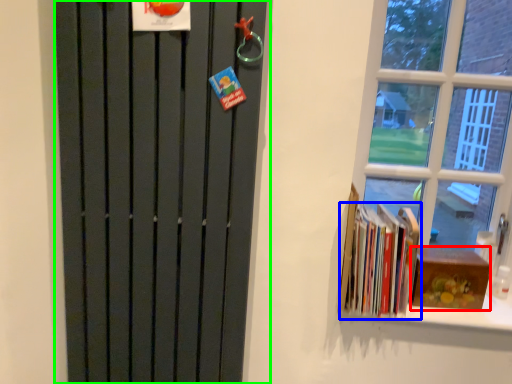
Question: Which object is positioned closest to paperback book (highlighted by a red box)? Select from book (highlighted by a blue box) and door (highlighted by a green box).

Choices:
 (A) book
 (B) door

Answer: (A)